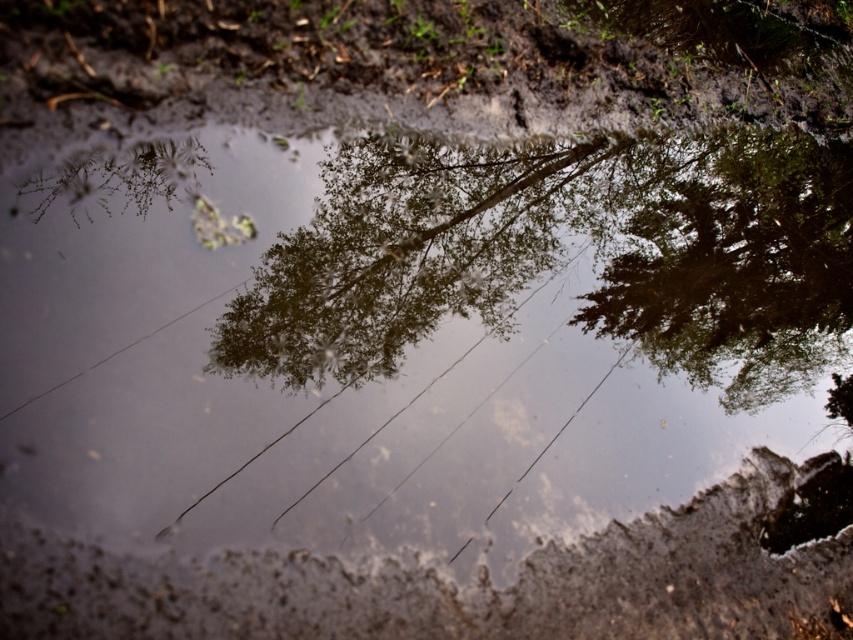
Is point (595, 243) closer to camera compared to point (660, 616)?

That is False.

Who is more distant from viewer, (451,192) or (4,604)?

The point (451,192) is behind.

Where is `green leafy tree at center`? green leafy tree at center is located at coordinates [564, 257].

Where is `green leafy tree at center`? green leafy tree at center is located at coordinates (564, 257).

Can you confirm if muddy wet ground at bottom is positioned to the left of green leafy tree at upper right?

Correct, you'll find muddy wet ground at bottom to the left of green leafy tree at upper right.

Who is more distant from viewer, (194, 598) or (635, 211)?

Point (635, 211)

Is point (223, 636) farther from camera compared to point (751, 365)?

That is False.

Find the location of a particular element. muddy wet ground at bottom is located at coordinates point(451,582).

Where is `green leafy tree at center`? The width and height of the screenshot is (853, 640). green leafy tree at center is located at coordinates pos(564,257).

Is point (784, 301) more distant than point (730, 400)?

Yes.

This screenshot has height=640, width=853. I want to click on green leafy tree at center, so click(564, 257).